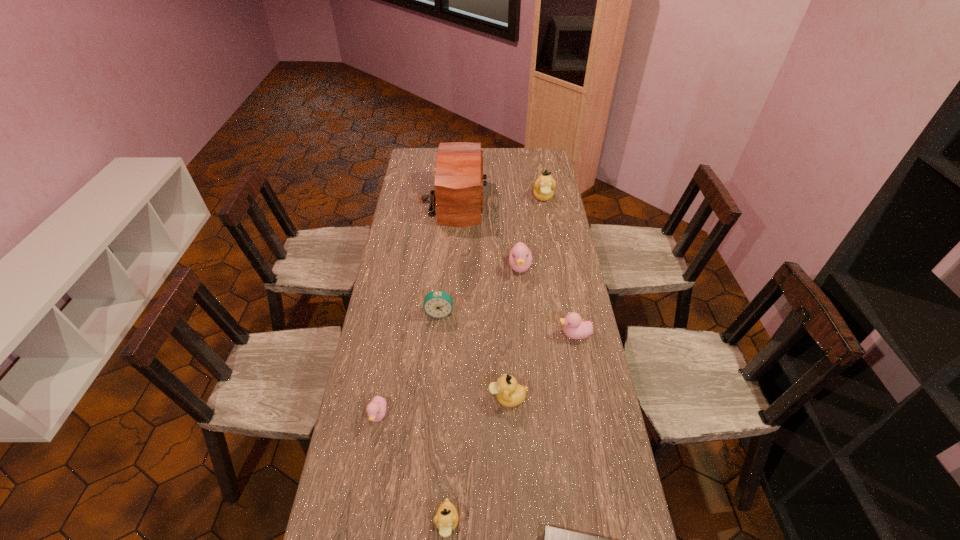
You are a GUI agent. You are given a task and a screenshot of the screen. Output one action in this format:
    pyautogui.click(x=<x>, y=<y>)
    Task: Click on the free space located on the front-facing side of the second biggest pink duckling
    
    Given the screenshot: What is the action you would take?
    pyautogui.click(x=461, y=335)

Image resolution: width=960 pixels, height=540 pixels. Identify the location of vacant space located 0.260m on the front-facing side of the second biggest pink duckling. (484, 335).

Identify the location of free space located on the front-facing side of the second biggest pink duckling. The image size is (960, 540). (455, 335).

The width and height of the screenshot is (960, 540). What are the coordinates of `vacant space located 0.090m on the front-facing side of the leftmost duckling` in the screenshot? It's located at (371, 460).

Where is `radio receiver that is positioned at the left edge`? radio receiver that is positioned at the left edge is located at coordinates (458, 184).

Where is `duckling situated at the left edge`? The image size is (960, 540). duckling situated at the left edge is located at coordinates (376, 409).

Locate an element on the screen. The image size is (960, 540). free space at the far edge of the desktop is located at coordinates point(513,165).

In the image, there is a desktop. Where is `vacant space at the left edge`? vacant space at the left edge is located at coordinates (333, 510).

Where is `vacant point at the right edge`? The height and width of the screenshot is (540, 960). vacant point at the right edge is located at coordinates (534, 224).

This screenshot has width=960, height=540. I want to click on free location at the far left corner, so click(425, 160).